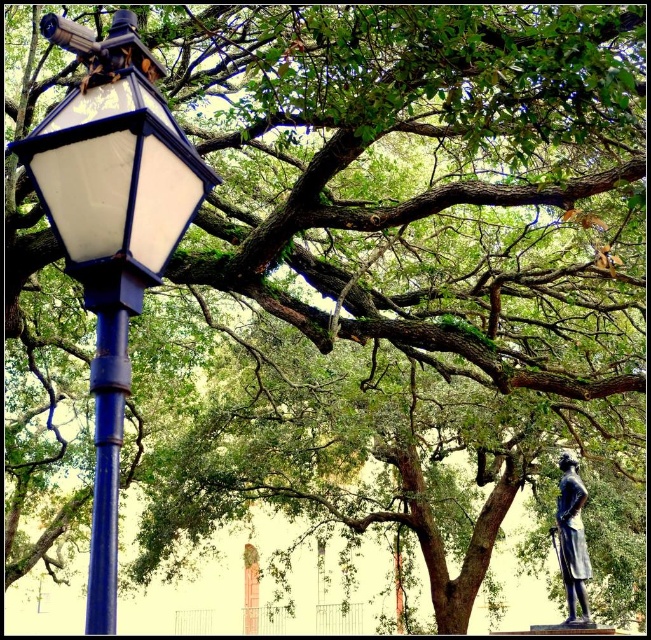
Who is positioned more to the right, matte blue streetlight at left or bronze statue at lower right?

Positioned to the right is bronze statue at lower right.

Measure the distance between matte blue streetlight at left and camera.

The distance of matte blue streetlight at left from camera is 1.97 meters.

The image size is (651, 640). Find the location of `matte blue streetlight at left`. matte blue streetlight at left is located at coordinates (111, 230).

Is matte blue streetlight at left taller than blue metallic pole at left?

Yes.

Is matte blue streetlight at left positioned in front of blue metallic pole at left?

That is True.

Between point (193, 184) and point (102, 584), which one is positioned in front?

Point (102, 584)

Where is `matte blue streetlight at left`? Image resolution: width=651 pixels, height=640 pixels. matte blue streetlight at left is located at coordinates (111, 230).

Between point (105, 381) and point (575, 564), which one is positioned in front?

Point (105, 381) is more forward.

Is the position of blue metallic pole at left more distant than that of bronze statue at lower right?

That is False.

Is point (87, 618) farther from viewer compared to point (589, 576)?

No, (87, 618) is in front of (589, 576).

Where is `blue metallic pole at left`? The width and height of the screenshot is (651, 640). blue metallic pole at left is located at coordinates (105, 465).